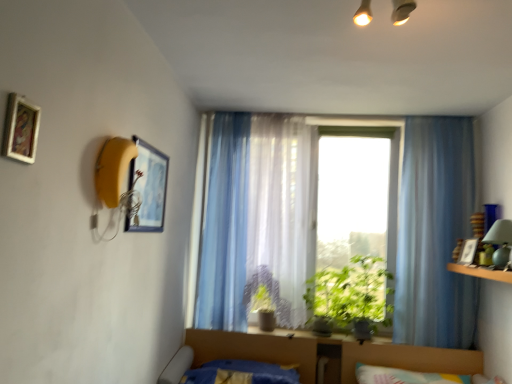
Question: Is translucent fabric window at center completely or partially inside wooden framed painting at upper left, acting as the 1th picture frame starting from the top?

Choices:
 (A) no
 (B) yes

Answer: (A)

Question: Is wooden framed painting at upper left, which is the first picture frame from front to back, not near translucent fabric window at center?

Choices:
 (A) yes
 (B) no

Answer: (A)

Question: From a real-world perspective, is wooden framed painting at upper left, which is the first picture frame from front to back, on translucent fabric window at center?

Choices:
 (A) yes
 (B) no

Answer: (A)

Question: From a real-world perspective, is wooden framed painting at upper left, which is counted as the third picture frame, starting from the right, under translucent fabric window at center?

Choices:
 (A) no
 (B) yes

Answer: (A)

Question: Is wooden framed painting at upper left, the 1th picture frame positioned from the left, turned away from translucent fabric window at center?

Choices:
 (A) no
 (B) yes

Answer: (A)

Question: From the image's perspective, is green leafy plant at center, placed as the 2th plant when sorted from left to right, located above or below green matte plant at center, marked as the second plant in a right-to-left arrangement?

Choices:
 (A) below
 (B) above

Answer: (B)

Question: From a real-world perspective, is green leafy plant at center, placed as the 2th plant when sorted from left to right, physically located above or below green matte plant at center, marked as the second plant in a right-to-left arrangement?

Choices:
 (A) below
 (B) above

Answer: (B)

Question: Choose the correct answer: Is green leafy plant at center, placed as the 2th plant when sorted from left to right, inside green matte plant at center, which is the 1th plant from left to right, or outside it?

Choices:
 (A) inside
 (B) outside

Answer: (B)

Question: Is point (310, 279) closer or farther from the camera than point (259, 289)?

Choices:
 (A) farther
 (B) closer

Answer: (A)

Question: Is translucent fabric curtain at center, which is the 2th curtain from left to right, taller or shorter than green glass lamp at right?

Choices:
 (A) tall
 (B) short

Answer: (A)

Question: Considering their positions, is translucent fabric curtain at center, acting as the 2th curtain starting from the right, located in front of or behind green glass lamp at right?

Choices:
 (A) behind
 (B) front

Answer: (A)

Question: In the image, is translucent fabric curtain at center, acting as the 2th curtain starting from the right, on the left side or the right side of green glass lamp at right?

Choices:
 (A) right
 (B) left

Answer: (B)

Question: In terms of size, does translucent fabric curtain at center, which is the 2th curtain from left to right, appear bigger or smaller than green glass lamp at right?

Choices:
 (A) big
 (B) small

Answer: (A)

Question: Looking at their shapes, would you say matte black picture frame at upper left, the 2th picture frame from the right, is wider or thinner than translucent fabric window at center?

Choices:
 (A) wide
 (B) thin

Answer: (B)

Question: Looking at the image, does matte black picture frame at upper left, the 2th picture frame from the right, seem bigger or smaller compared to translucent fabric window at center?

Choices:
 (A) big
 (B) small

Answer: (B)